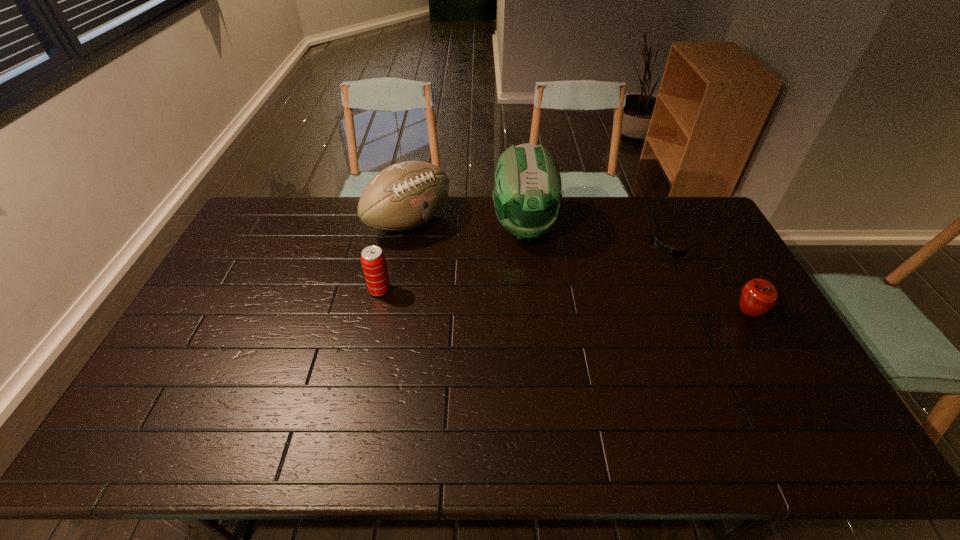
Locate an element on the screen. The height and width of the screenshot is (540, 960). sunglasses at the far edge is located at coordinates coord(671,252).

Find the location of a particular element. football (American) that is at the far edge is located at coordinates (403, 196).

Identify the location of apple located at the right edge. This screenshot has height=540, width=960. (758, 296).

This screenshot has width=960, height=540. I want to click on sunglasses situated at the right edge, so click(x=671, y=252).

The height and width of the screenshot is (540, 960). I want to click on object that is at the far right corner, so click(671, 252).

Locate an element on the screen. This screenshot has height=540, width=960. vacant space at the far edge of the desktop is located at coordinates (489, 233).

Locate an element on the screen. This screenshot has width=960, height=540. vacant position at the left edge of the desktop is located at coordinates (220, 273).

The width and height of the screenshot is (960, 540). In order to click on free region at the right edge of the desktop in this screenshot , I will do `click(784, 361)`.

I want to click on vacant space at the far right corner of the desktop, so click(697, 208).

Find the location of a particular element. vacant space that's between the football helmet and the football (American) is located at coordinates (467, 224).